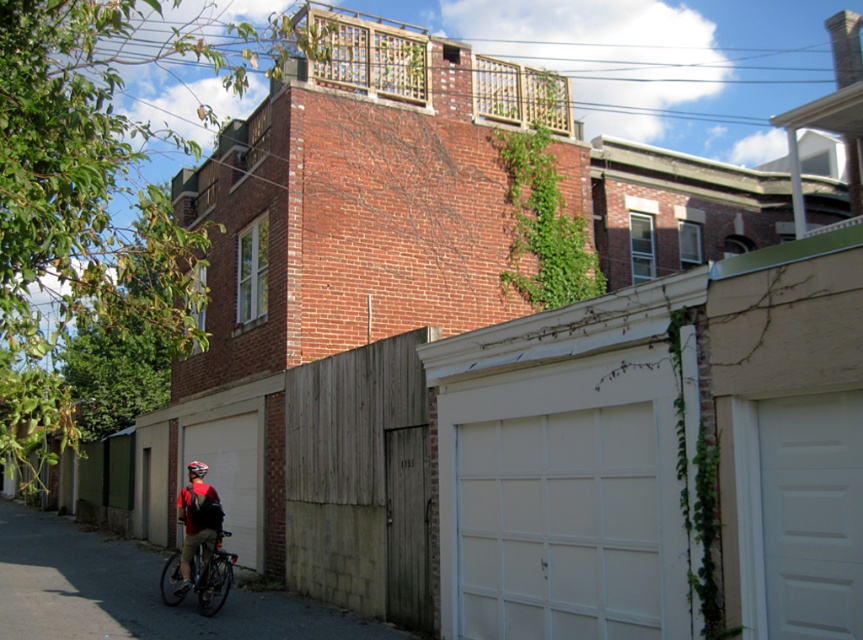
Question: Can you confirm if wooden fence at lower left is positioned below matte black bicycle at lower left?

Choices:
 (A) yes
 (B) no

Answer: (A)

Question: Can you confirm if wooden fence at lower left is positioned below matte black bicycle at lower left?

Choices:
 (A) yes
 (B) no

Answer: (A)

Question: Based on their relative distances, which object is farther from the red helmeted cyclist at lower left?

Choices:
 (A) matte black bicycle at lower left
 (B) white painted wood garage door at lower center

Answer: (B)

Question: Which object is the farthest from the red helmeted cyclist at lower left?

Choices:
 (A) white painted wood garage door at lower center
 (B) matte black bicycle at lower left
 (C) wooden fence at lower left

Answer: (A)

Question: Based on their relative distances, which object is farther from the red helmeted cyclist at lower left?

Choices:
 (A) matte black bicycle at lower left
 (B) wooden fence at lower left
 (C) white painted wood garage door at lower center

Answer: (C)

Question: Can you confirm if white painted wood garage door at lower center is smaller than matte black bicycle at lower left?

Choices:
 (A) no
 (B) yes

Answer: (A)